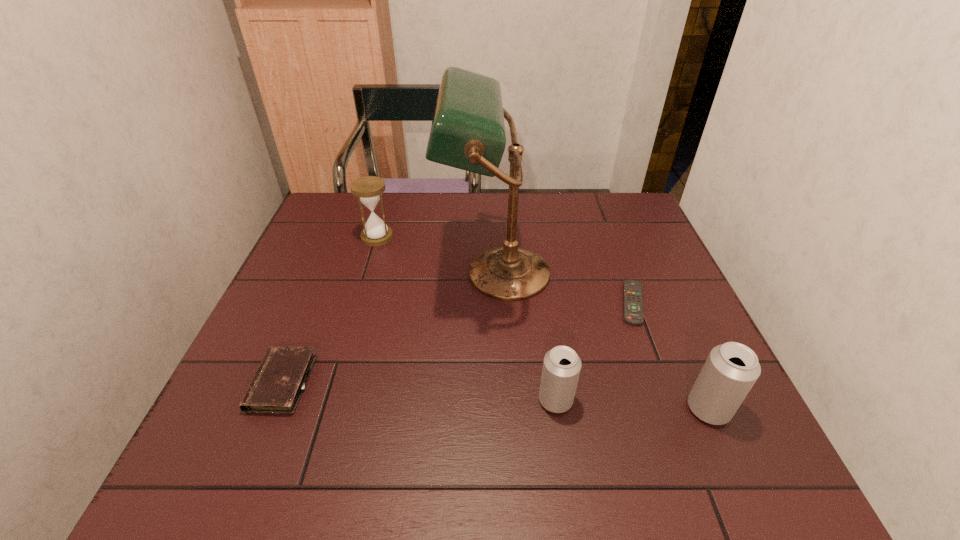
Identify the location of vacant space located 0.190m above the green lampshade of the table lamp. The width and height of the screenshot is (960, 540). (372, 273).

This screenshot has height=540, width=960. I want to click on vacant region located above the green lampshade of the table lamp, so (423, 273).

Find the location of a particular element. The width and height of the screenshot is (960, 540). blank space located above the green lampshade of the table lamp is located at coordinates (405, 273).

Find the location of a particular element. Image resolution: width=960 pixels, height=540 pixels. free location located on the front of the hourglass is located at coordinates (345, 345).

In order to click on free spot located on the back of the leftmost object in this screenshot , I will do `click(300, 338)`.

Locate an element on the screen. free space located 0.310m on the left of the shortest object is located at coordinates (493, 303).

This screenshot has width=960, height=540. In order to click on table lamp located at the far edge in this screenshot , I will do `click(468, 130)`.

The width and height of the screenshot is (960, 540). In order to click on hourglass positioned at the far edge in this screenshot , I will do `click(368, 189)`.

The image size is (960, 540). I want to click on diary that is at the near edge, so [x=278, y=383].

Where is `object that is at the left edge`? object that is at the left edge is located at coordinates (278, 383).